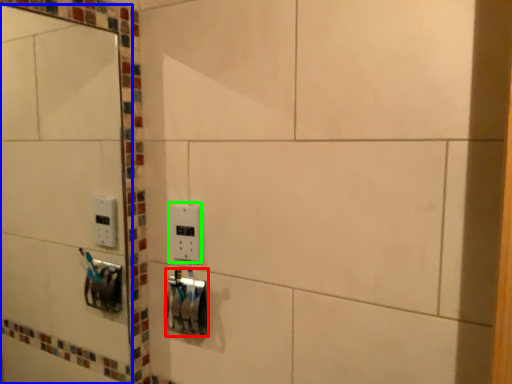
Question: Which object is the farthest from lock (highlighted by a red box)? Choose among these: mirror (highlighted by a blue box) or light switch (highlighted by a green box).

Choices:
 (A) mirror
 (B) light switch

Answer: (A)